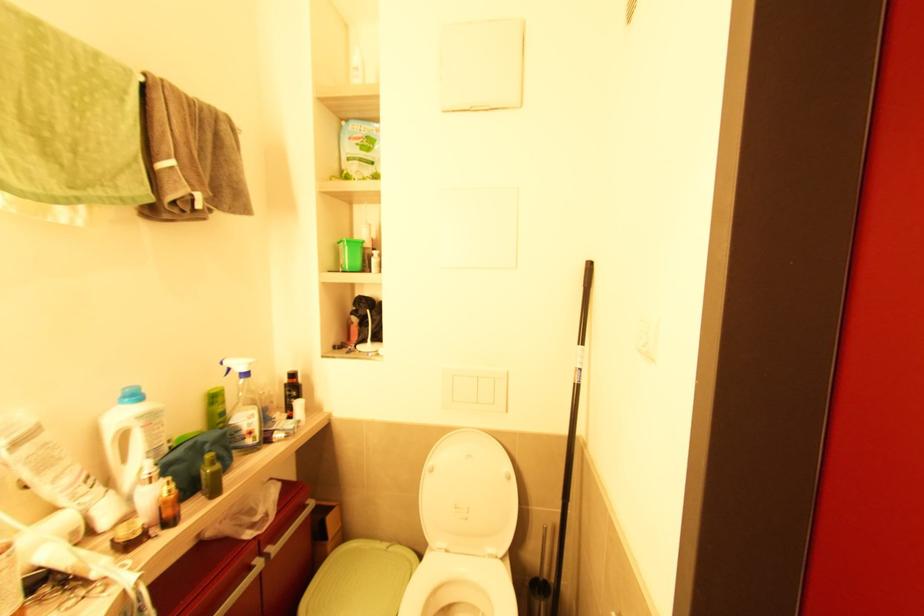
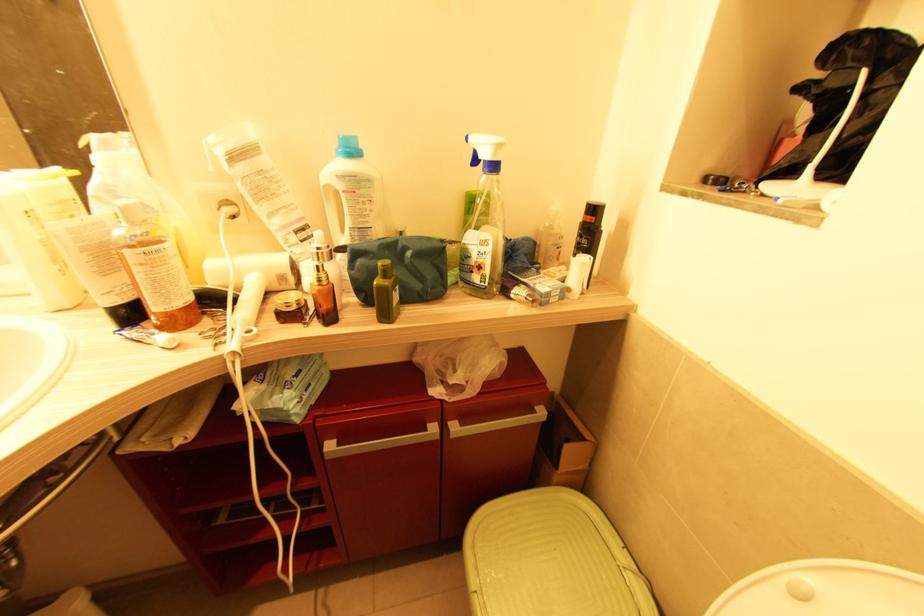
In the second image, find the point that corresponds to (76,533) in the first image.

(284, 278)